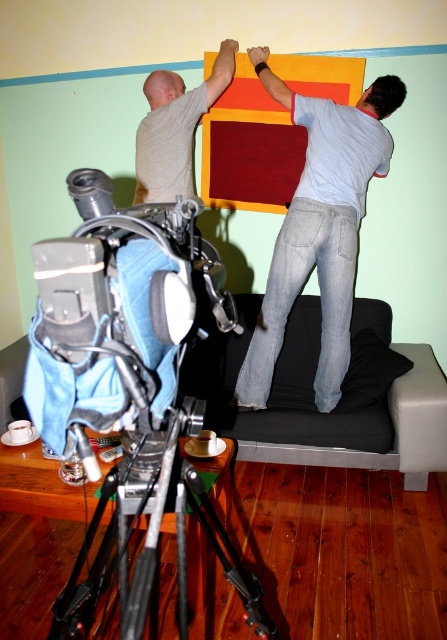
Question: Which object is closer to the camera taking this photo?

Choices:
 (A) black metal tripod at lower left
 (B) light blue denim jeans at upper right
 (C) black fabric couch at lower right

Answer: (A)

Question: Is black fabric couch at lower right smaller than matte gray shirt at upper center?

Choices:
 (A) yes
 (B) no

Answer: (B)

Question: Can you confirm if black metal tripod at lower left is wider than matte gray shirt at upper center?

Choices:
 (A) no
 (B) yes

Answer: (B)

Question: Is black fabric couch at lower right positioned before light blue denim jeans at upper right?

Choices:
 (A) yes
 (B) no

Answer: (A)

Question: Which point appears farthest from the camera in this image?

Choices:
 (A) (49, 348)
 (B) (185, 173)
 (C) (151, 524)
 (D) (256, 438)

Answer: (B)

Question: Estimate the real-world distances between objects in this image. Which object is closer to the metallic silver tripod at lower left?

Choices:
 (A) black fabric couch at lower right
 (B) matte gray shirt at upper center

Answer: (A)